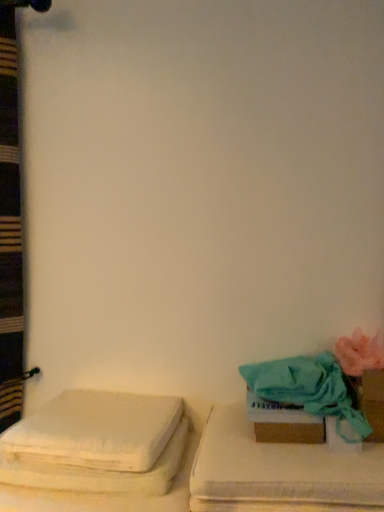
Question: In the image, is white fabric cushion at left, the 2th furniture positioned from the right, on the left side or the right side of pink fabric flower at right?

Choices:
 (A) left
 (B) right

Answer: (A)

Question: Based on their sizes in the image, would you say white fabric cushion at left, arranged as the first furniture when viewed from the left, is bigger or smaller than pink fabric flower at right?

Choices:
 (A) small
 (B) big

Answer: (B)

Question: Which object is positioned closest to the brown cardboard box at lower right?

Choices:
 (A) teal fabric towel at lower right
 (B) white fabric cushion at left, the 2th furniture positioned from the right
 (C) teal fabric cushion at right, which is the second furniture from left to right
 (D) pink fabric flower at right

Answer: (A)

Question: Which object is the farthest from the teal fabric towel at lower right?

Choices:
 (A) brown cardboard box at lower right
 (B) pink fabric flower at right
 (C) teal fabric cushion at right, which is the 1th furniture in right-to-left order
 (D) white fabric cushion at left, arranged as the first furniture when viewed from the left

Answer: (D)